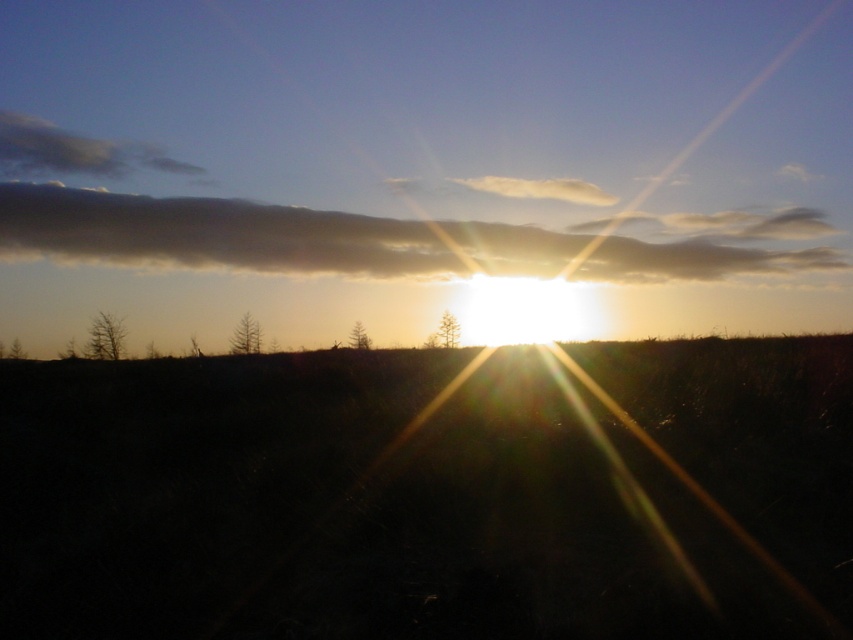
Question: Which of these objects is positioned farthest from the white fluffy cloud at upper center?

Choices:
 (A) dark gray cloud at upper center
 (B) white fluffy cloud at upper left

Answer: (B)

Question: Is white fluffy cloud at upper left positioned at the back of white fluffy cloud at upper center?

Choices:
 (A) yes
 (B) no

Answer: (A)

Question: Does dark gray cloud at upper center have a smaller size compared to white fluffy cloud at upper left?

Choices:
 (A) no
 (B) yes

Answer: (A)

Question: Estimate the real-world distances between objects in this image. Which object is closer to the dark gray cloud at upper center?

Choices:
 (A) white fluffy cloud at upper center
 (B) white fluffy cloud at upper left

Answer: (A)

Question: Among these points, which one is farthest from the camera?

Choices:
 (A) (462, 180)
 (B) (24, 168)
 (C) (231, 221)

Answer: (B)

Question: Is the position of dark gray cloud at upper center more distant than that of white fluffy cloud at upper left?

Choices:
 (A) no
 (B) yes

Answer: (A)